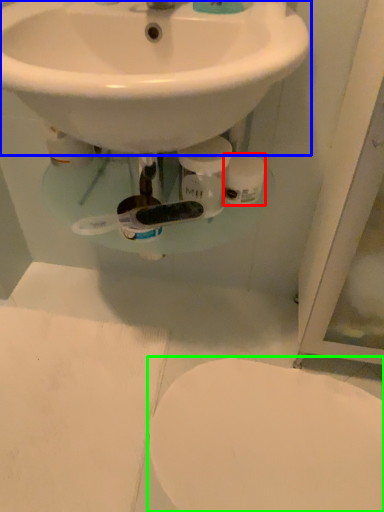
Question: Which is farther away from toilet paper (highlighted by a red box)? sink (highlighted by a blue box) or toilet (highlighted by a green box)?

Choices:
 (A) sink
 (B) toilet

Answer: (B)